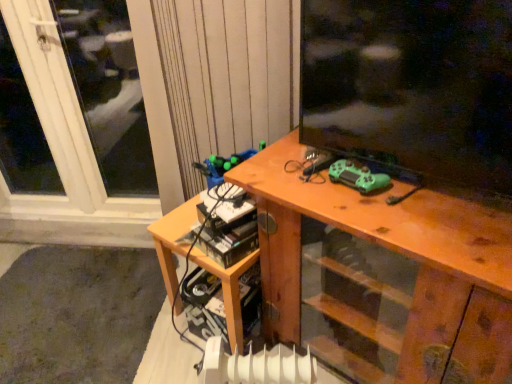
The image size is (512, 384). In order to click on vacant space to the left of green matte game controller at center in this screenshot , I will do (x=300, y=185).